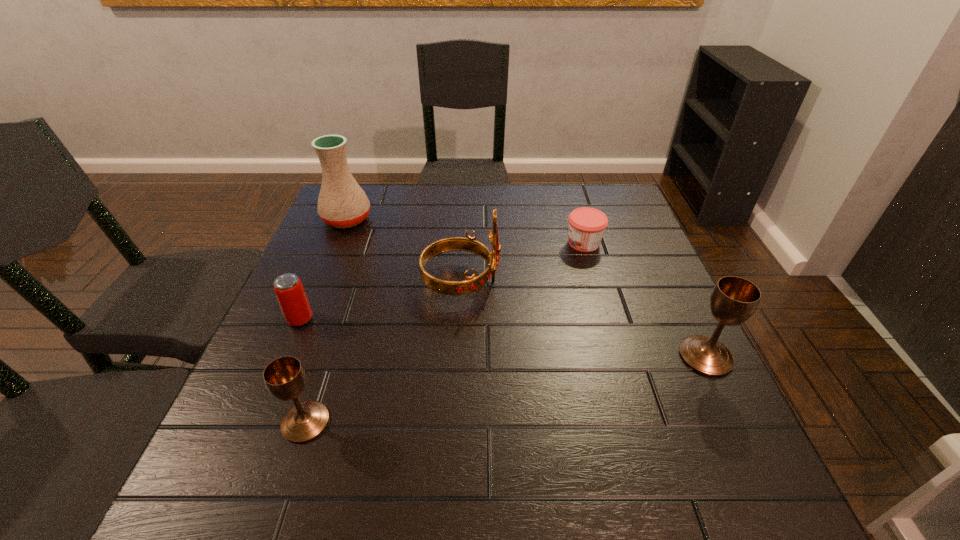
You are a GUI agent. You are given a task and a screenshot of the screen. Output one action in this format:
    pyautogui.click(x=<x>, y=<y>)
    Task: Click on the vacant space at the right edge of the desktop
    
    Given the screenshot: What is the action you would take?
    pyautogui.click(x=660, y=331)

You are a GUI agent. You are given a task and a screenshot of the screen. Output one action in this format:
    pyautogui.click(x=<x>, y=<y>)
    Task: Click on the blank space at the far left corner of the desktop
    The image size is (960, 540).
    Given the screenshot: What is the action you would take?
    pyautogui.click(x=382, y=199)

Find the location of a particular element. The image size is (960, 540). vacant space at the near left corner of the desktop is located at coordinates (251, 415).

At what (x,y) coordinates should I click in order to perform the action: click on free space at the far right corner of the desktop. Please return your answer as a coordinate pair (x, y). Looking at the image, I should click on 602,186.

You are a GUI agent. You are given a task and a screenshot of the screen. Output one action in this format:
    pyautogui.click(x=<x>, y=<y>)
    Task: Click on the vacant space that's between the fifth tallest object and the third object from right to left
    The image size is (960, 540).
    Given the screenshot: What is the action you would take?
    pyautogui.click(x=380, y=300)

Find the location of a particular element. This screenshot has width=960, height=540. free space between the third farthest object and the shortest object is located at coordinates (522, 262).

You are a GUI agent. You are given a task and a screenshot of the screen. Output one action in this format:
    pyautogui.click(x=<x>, y=<y>)
    Task: Click on the empty space between the third object from right to left and the third nearest object
    Image resolution: width=960 pixels, height=540 pixels.
    Given the screenshot: What is the action you would take?
    pyautogui.click(x=380, y=300)

This screenshot has height=540, width=960. In order to click on vacant area between the pottery and the second shortest object in this screenshot , I will do `click(324, 269)`.

This screenshot has width=960, height=540. I want to click on free space between the fifth farthest object and the jam, so click(x=645, y=300).

Find the location of a particular element. The width and height of the screenshot is (960, 540). free space between the jam and the farther chalice is located at coordinates [x=645, y=300].